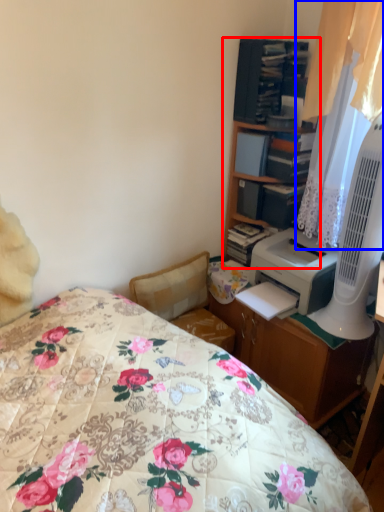
Question: Which object is closer to the camera taking this photo, cabinetry (highlighted by a red box) or curtain (highlighted by a blue box)?

Choices:
 (A) cabinetry
 (B) curtain

Answer: (B)